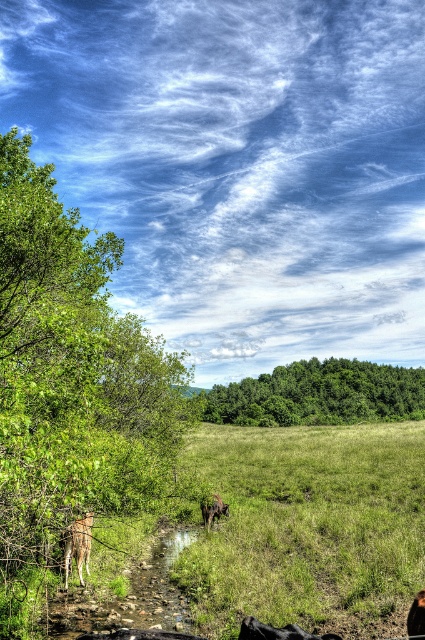
You are standing at the center of the field and see the green leafy tree at left and the brown furry dog at lower right. Which object is positioned to the left of the other?

The green leafy tree at left is to the left of the brown furry dog at lower right.

You are a photographer standing at the camera position. You want to take a photo of the brown fur deer at left. The camera has a maximum zoom range of 30 feet. Can you capture the deer without moving closer?

The brown fur deer at left is 35.89 feet from the camera. Since the camera can only zoom up to 30 feet, you cannot capture the deer clearly without moving closer.

You are a photographer setting up a tripod in the field. You want to capture both the green leafy tree at left and the brown fur deer at left in your shot. Based on their sizes, which one do you think will occupy more space in the photo?

The green leafy tree at left might be wider than brown fur deer at left, so it will likely occupy more space in the photo.